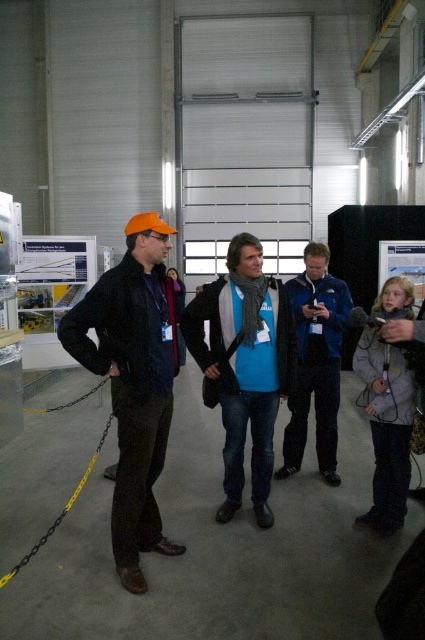
Question: Is blue matte shirt at center to the left of blue fabric jacket at center from the viewer's perspective?

Choices:
 (A) no
 (B) yes

Answer: (B)

Question: Does matte black jacket at left appear on the left side of blue matte shirt at center?

Choices:
 (A) no
 (B) yes

Answer: (B)

Question: Where is blue matte shirt at center located in relation to blue fabric jacket at center in the image?

Choices:
 (A) left
 (B) right

Answer: (A)

Question: Considering the real-world distances, which object is farthest from the blue fabric jacket at center?

Choices:
 (A) blue matte shirt at center
 (B) matte black jacket at left

Answer: (B)

Question: Which of these objects is positioned closest to the blue matte shirt at center?

Choices:
 (A) matte black jacket at left
 (B) blue fabric jacket at center

Answer: (B)

Question: Among these objects, which one is farthest from the camera?

Choices:
 (A) blue fabric jacket at center
 (B) matte black jacket at left
 (C) blue matte shirt at center

Answer: (A)